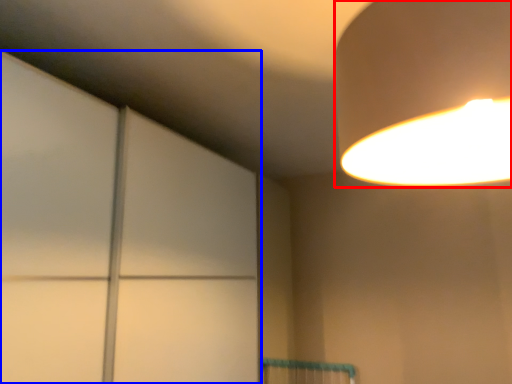
Question: Which object is closer to the camera taking this photo, lamp (highlighted by a red box) or glass door (highlighted by a blue box)?

Choices:
 (A) lamp
 (B) glass door

Answer: (A)